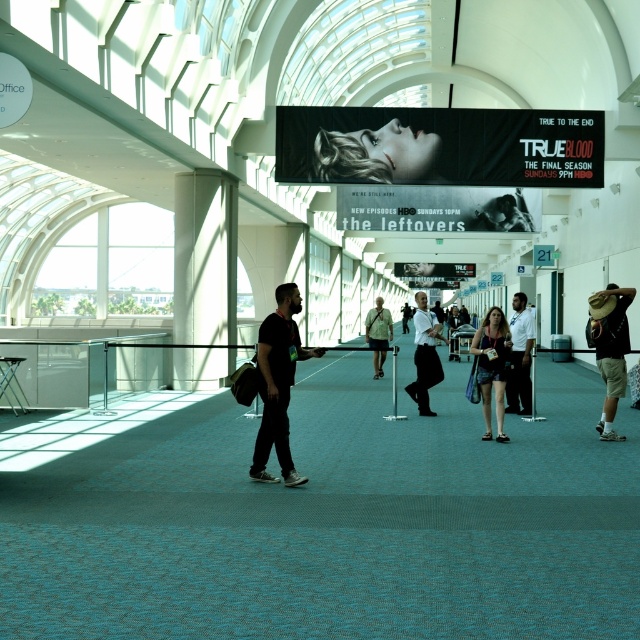
Is point (520, 376) positioned in front of point (417, 365)?

Yes, point (520, 376) is in front of point (417, 365).

Between point (513, 369) and point (433, 353), which one is positioned in front?

Positioned in front is point (513, 369).

Does point (529, 358) come in front of point (429, 337)?

That is False.

I want to click on white shirt at center, so click(518, 356).

Between blonde hair at upper center and matte black hat at right, which one appears on the right side from the viewer's perspective?

matte black hat at right is more to the right.

Which is more to the left, blonde hair at upper center or matte black hat at right?

blonde hair at upper center is more to the left.

Identify the location of blonde hair at upper center. The height and width of the screenshot is (640, 640). (376, 154).

From the picture: Which of these two, black matte shirt at center or matte black hat at right, stands shorter?

black matte shirt at center is shorter.

Does black matte shirt at center have a greater height compared to matte black hat at right?

No.

Where is `black matte shirt at center`? Image resolution: width=640 pixels, height=640 pixels. black matte shirt at center is located at coordinates (278, 384).